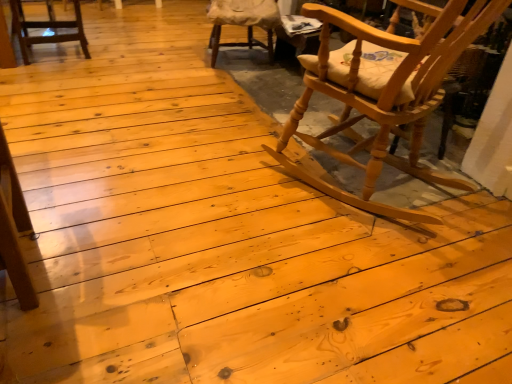
Where is `free location in front of natural wood rocking chair at right, acting as the 1th chair starting from the right`? This screenshot has height=384, width=512. free location in front of natural wood rocking chair at right, acting as the 1th chair starting from the right is located at coordinates (362, 283).